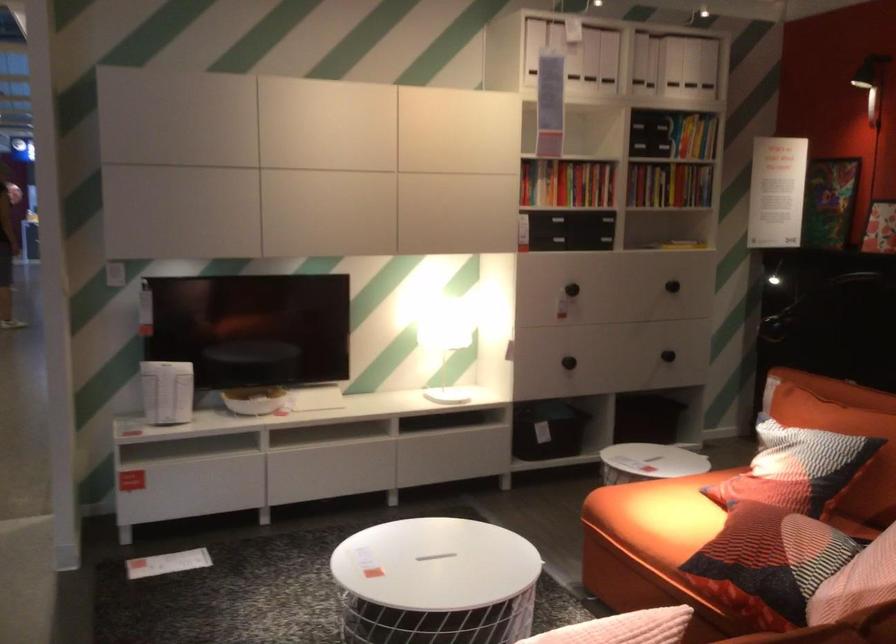
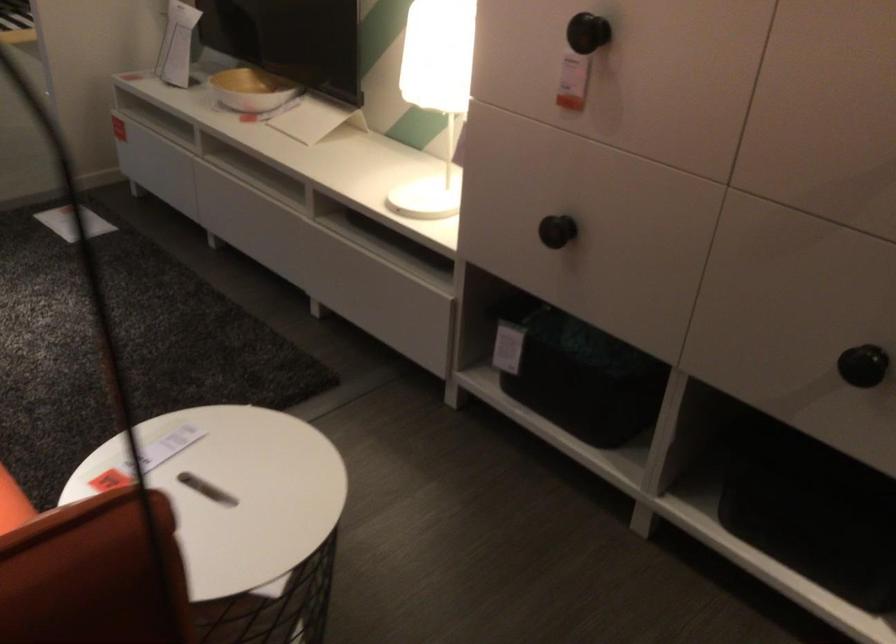
Locate, in the second image, the point that corresponds to (x=599, y=270) in the first image.

(588, 33)